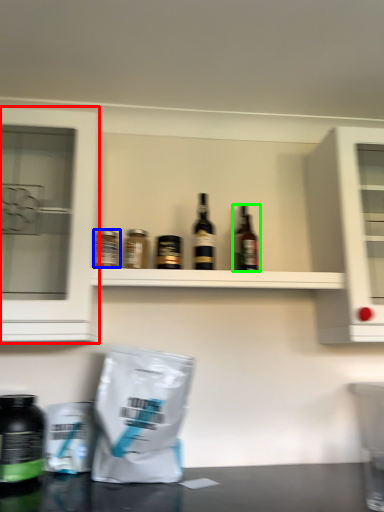
Question: Considering the real-world distances, which object is farthest from cabinetry (highlighted by a red box)? bottle (highlighted by a blue box) or bottle (highlighted by a green box)?

Choices:
 (A) bottle
 (B) bottle

Answer: (B)